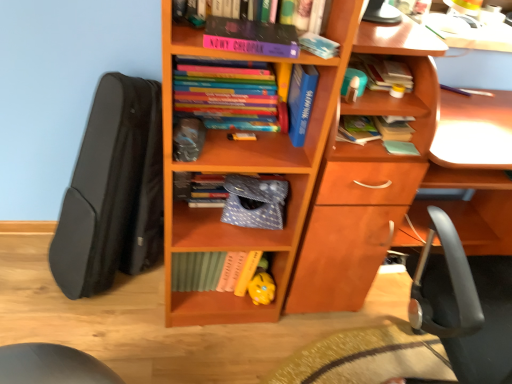
Question: Which direction should I rotate to look at purple matte book at upper center, positioned as the 2th book in left-to-right order?

Choices:
 (A) left
 (B) right

Answer: (A)

Question: Considering the relative sizes of wooden bookcase at center and purple matte book at upper center, which is counted as the sixth book, starting from the right, in the image provided, is wooden bookcase at center thinner than purple matte book at upper center, which is counted as the sixth book, starting from the right,?

Choices:
 (A) yes
 (B) no

Answer: (B)

Question: From the image's perspective, is wooden bookcase at center under purple matte book at upper center, positioned as the 2th book in left-to-right order?

Choices:
 (A) yes
 (B) no

Answer: (A)

Question: Would you consider wooden bookcase at center to be distant from purple matte book at upper center, positioned as the 2th book in left-to-right order?

Choices:
 (A) no
 (B) yes

Answer: (A)

Question: Is wooden bookcase at center wider than purple matte book at upper center, which is counted as the sixth book, starting from the right?

Choices:
 (A) yes
 (B) no

Answer: (A)

Question: Is wooden bookcase at center to the right of purple matte book at upper center, which is counted as the sixth book, starting from the right, from the viewer's perspective?

Choices:
 (A) yes
 (B) no

Answer: (B)

Question: Is wooden bookcase at center aimed at purple matte book at upper center, which is counted as the sixth book, starting from the right?

Choices:
 (A) no
 (B) yes

Answer: (B)

Question: Considering the relative sizes of blue matte book at upper center, the 4th book when ordered from right to left, and hardcover book at upper right, which ranks as the sixth book in left-to-right order, in the image provided, is blue matte book at upper center, the 4th book when ordered from right to left, thinner than hardcover book at upper right, which ranks as the sixth book in left-to-right order,?

Choices:
 (A) no
 (B) yes

Answer: (A)

Question: Is blue matte book at upper center, the fourth book positioned from the left, placed right next to hardcover book at upper right, which ranks as the sixth book in left-to-right order?

Choices:
 (A) no
 (B) yes

Answer: (A)

Question: Is blue matte book at upper center, the 4th book when ordered from right to left, oriented away from hardcover book at upper right, arranged as the second book when viewed from the right?

Choices:
 (A) no
 (B) yes

Answer: (A)

Question: Does blue matte book at upper center, the 4th book when ordered from right to left, contain hardcover book at upper right, which ranks as the sixth book in left-to-right order?

Choices:
 (A) no
 (B) yes

Answer: (A)

Question: Is the position of blue matte book at upper center, the 4th book when ordered from right to left, less distant than that of hardcover book at upper right, arranged as the second book when viewed from the right?

Choices:
 (A) yes
 (B) no

Answer: (A)

Question: Considering the relative sizes of blue matte book at upper center, the fourth book positioned from the left, and hardcover book at upper right, arranged as the second book when viewed from the right, in the image provided, is blue matte book at upper center, the fourth book positioned from the left, wider than hardcover book at upper right, arranged as the second book when viewed from the right,?

Choices:
 (A) yes
 (B) no

Answer: (A)

Question: Does blue hardcover book at upper center, the 3th book positioned from the left, lie behind hardcover book at upper right, which ranks as the sixth book in left-to-right order?

Choices:
 (A) yes
 (B) no

Answer: (B)